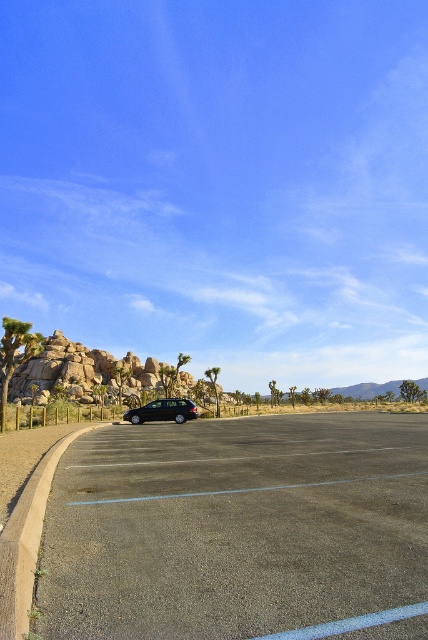
Question: Does gray asphalt parking lot at center have a lesser width compared to black matte car at center?

Choices:
 (A) yes
 (B) no

Answer: (B)

Question: Considering the relative positions of gray asphalt parking lot at center and black matte car at center in the image provided, where is gray asphalt parking lot at center located with respect to black matte car at center?

Choices:
 (A) below
 (B) above

Answer: (B)

Question: Does gray asphalt parking lot at center appear on the left side of black matte car at center?

Choices:
 (A) no
 (B) yes

Answer: (A)

Question: Which of the following is the closest to the observer?

Choices:
 (A) gray asphalt parking lot at center
 (B) black matte car at center

Answer: (A)